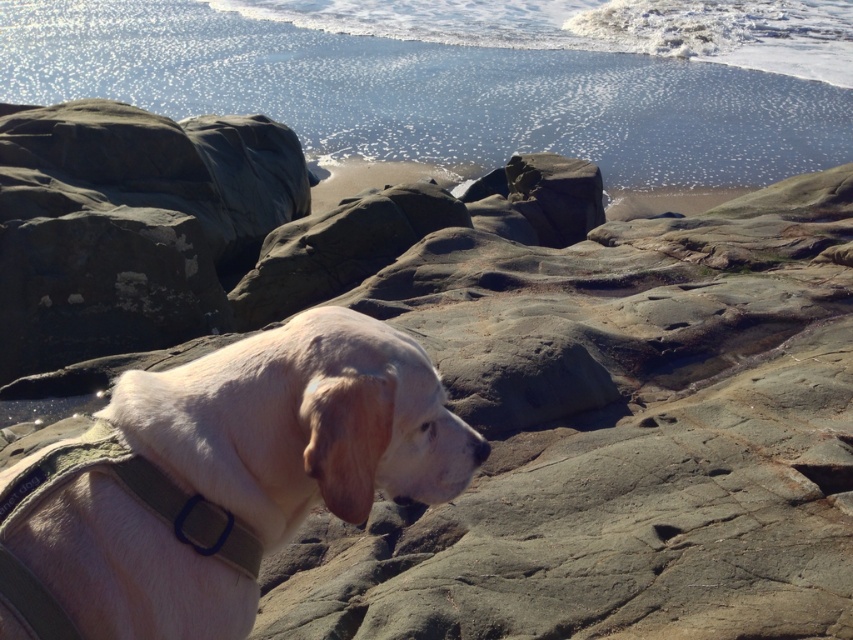
Question: Does shiny blue water at upper center appear under light beige fur at center?

Choices:
 (A) yes
 (B) no

Answer: (B)

Question: Is shiny blue water at upper center thinner than light beige fur at center?

Choices:
 (A) no
 (B) yes

Answer: (A)

Question: Is shiny blue water at upper center wider than light beige fur at center?

Choices:
 (A) yes
 (B) no

Answer: (A)